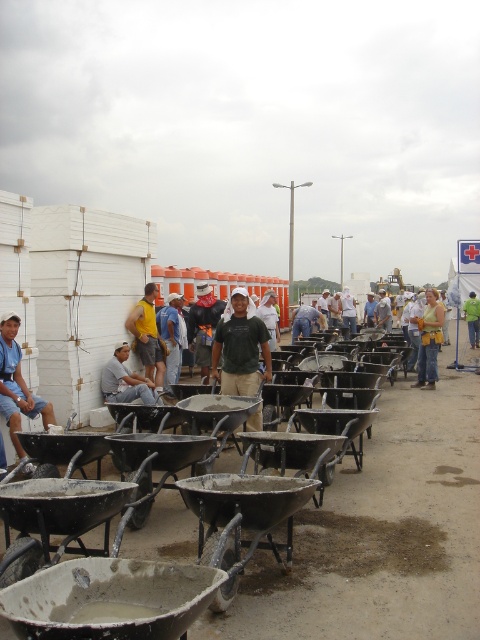
Is point (418, 419) less distant than point (9, 349)?

That is False.

Who is shorter, matte black wheelbarrow at center or matte blue shirt at left?

matte black wheelbarrow at center is shorter.

Who is more forward, (411, 556) or (2, 356)?

Point (411, 556) is more forward.

The width and height of the screenshot is (480, 640). What are the coordinates of `matte black wheelbarrow at center` in the screenshot? It's located at (347, 547).

Does point (228, 381) come in front of point (379, 301)?

Yes, point (228, 381) is closer to viewer.

Does point (254, 333) come behind point (387, 330)?

No.

You are a GUI agent. You are given a task and a screenshot of the screen. Output one action in this format:
    pyautogui.click(x=<x>, y=<y>)
    Task: Click on the dark green t-shirt at center
    The height and width of the screenshot is (640, 480).
    Given the screenshot: What is the action you would take?
    pyautogui.click(x=240, y=348)

Measure the distance from matte green shirt at center to dark green shirt at center.

They are 5.64 meters apart.

Between matte green shirt at center and dark green shirt at center, which one appears on the right side from the viewer's perspective?

dark green shirt at center

Which is in front, point (300, 333) or point (384, 321)?

Point (300, 333)

Where is `matte green shirt at center`? This screenshot has height=640, width=480. matte green shirt at center is located at coordinates (303, 321).